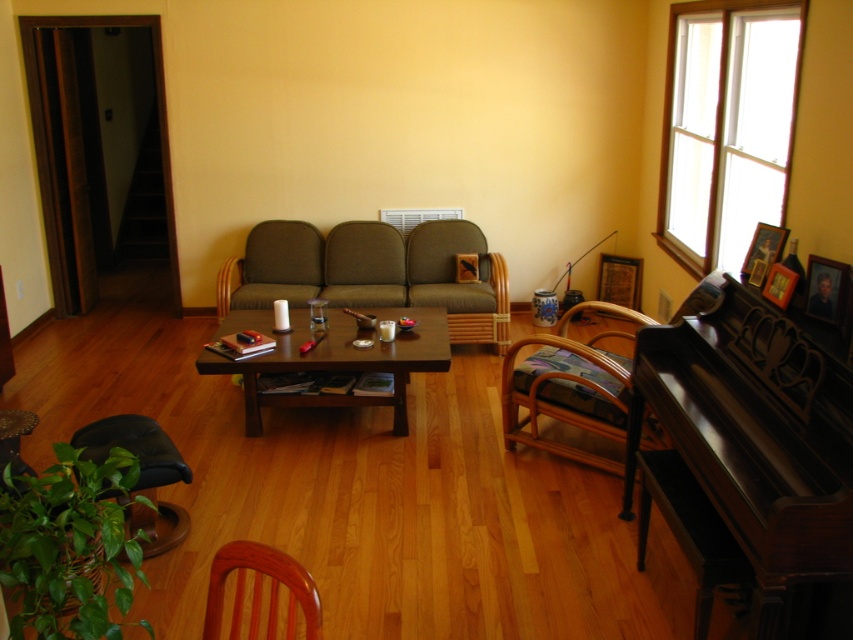
Can you confirm if dark polished wood piano at right is positioned above brown wooden table at center?

Incorrect, dark polished wood piano at right is not positioned above brown wooden table at center.

Is dark polished wood piano at right bigger than brown wooden table at center?

Actually, dark polished wood piano at right might be smaller than brown wooden table at center.

Which is behind, point (706, 385) or point (410, 314)?

Point (410, 314)

The height and width of the screenshot is (640, 853). I want to click on dark polished wood piano at right, so click(x=746, y=456).

Does brown wooden table at center have a smaller size compared to black leather chair at lower left?

Incorrect, brown wooden table at center is not smaller in size than black leather chair at lower left.

Is point (415, 317) positioned before point (105, 417)?

No, it is not.

The image size is (853, 640). What are the coordinates of `brown wooden table at center` in the screenshot? It's located at (340, 362).

Is point (720, 218) more distant than point (485, 330)?

No, it is not.

The image size is (853, 640). What do you see at coordinates (726, 125) in the screenshot? I see `white wooden window at upper right` at bounding box center [726, 125].

Who is more forward, (x=729, y=120) or (x=474, y=227)?

Positioned in front is point (x=729, y=120).

Image resolution: width=853 pixels, height=640 pixels. What are the coordinates of `white wooden window at upper right` in the screenshot? It's located at (726, 125).